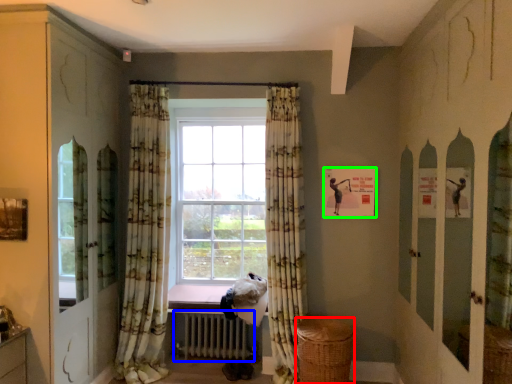
Question: Which is nearer to the basket (highlighted by a red box)? radiator (highlighted by a blue box) or picture frame (highlighted by a green box).

Choices:
 (A) radiator
 (B) picture frame

Answer: (A)